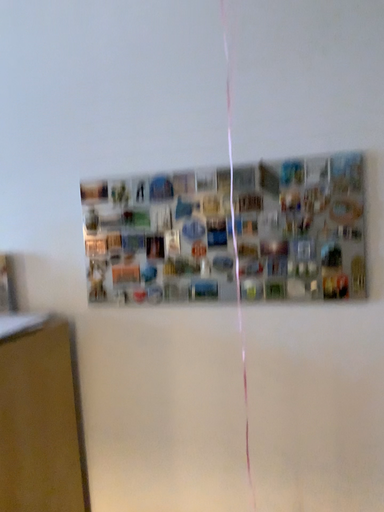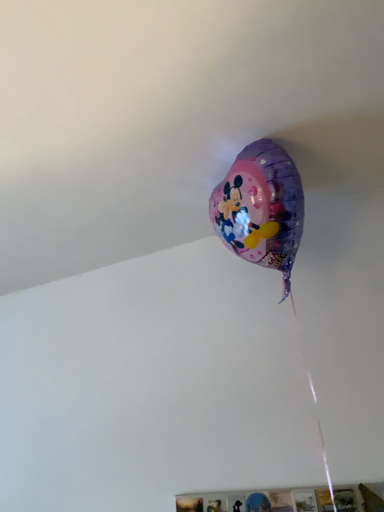
Question: How did the camera likely rotate when shooting the video?

Choices:
 (A) rotated upward
 (B) rotated downward

Answer: (A)